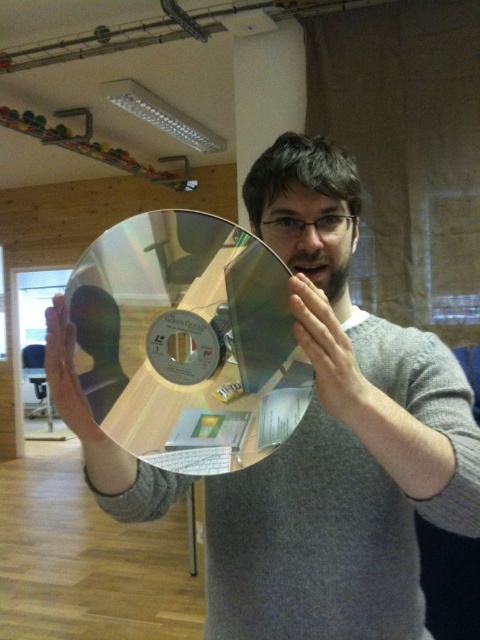
You are an interior designer assessing the placement of objects in the room. The scene includes a matte metallic face at center and a metallic gold at center. Which object is positioned higher in the image?

The matte metallic face at center is located above the metallic gold at center, so it is positioned higher in the image.

You are a delivery person who needs to place a small package between the matte metallic face at center and the metallic gold at center. The package is 8 inches long. Can you fit it between them without moving either object?

The distance between the matte metallic face at center and the metallic gold at center is 7.65 inches. Since the package is 8 inches long, which is slightly longer than the available space, it won t fit between them without moving either object.

You are an interior designer assessing the lighting in the room. You notice the metallic gold at center and the matte gold disc at center. Which object is casting a brighter reflection due to its surface properties?

The metallic gold at center is positioned over matte gold disc at center, so the metallic gold at center is casting a brighter reflection because metallic surfaces typically reflect more light than matte ones.